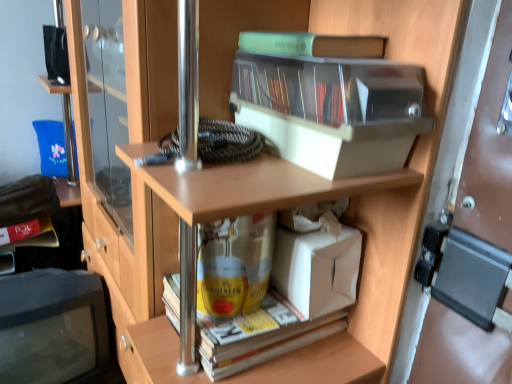
The height and width of the screenshot is (384, 512). Find the location of `transparent plastic storage box at upper center`. transparent plastic storage box at upper center is located at coordinates (331, 110).

You are a GUI agent. You are given a task and a screenshot of the screen. Output one action in this format:
    pyautogui.click(x=<x>, y=<y>)
    Task: Click on the green plastic book at upper center, acting as the 3th book starting from the bottom
    The image size is (512, 384).
    Given the screenshot: What is the action you would take?
    pyautogui.click(x=313, y=44)

What is the approximate width of green plastic book at upper center, acting as the 3th book starting from the bottom?

It is 6.25 inches.

The height and width of the screenshot is (384, 512). What do you see at coordinates (52, 327) in the screenshot?
I see `matte black monitor at lower left` at bounding box center [52, 327].

Locate an element on the screen. Image resolution: width=512 pixels, height=384 pixels. yellow paperback book at lower center, positioned as the second book in back-to-front order is located at coordinates (261, 337).

Relative to yellow paperback book at lower center, which is the first book from bottom to top, is matte yellow book at lower left, the first book viewed from the left, in front or behind?

Visually, matte yellow book at lower left, the first book viewed from the left, is located behind yellow paperback book at lower center, which is the first book from bottom to top.

How much distance is there between matte yellow book at lower left, positioned as the 3th book in right-to-left order, and yellow paperback book at lower center, which is counted as the second book, starting from the front?

They are 36.94 inches apart.

In order to click on book that is below the matte yellow book at lower left, positioned as the 3th book in right-to-left order (from the image's perspective) in this screenshot , I will do `click(261, 337)`.

Which of these two, matte yellow book at lower left, the third book from the front, or yellow paperback book at lower center, positioned as the second book in back-to-front order, is thinner?

With smaller width is matte yellow book at lower left, the third book from the front.

Does green plastic book at upper center, acting as the 3th book starting from the bottom, appear on the left side of yellow paperback book at lower center, which is the 3th book in top-to-bottom order?

No.

Is green plastic book at upper center, acting as the 3th book starting from the bottom, next to yellow paperback book at lower center, which is counted as the second book, starting from the front?

No, green plastic book at upper center, acting as the 3th book starting from the bottom, is not next to yellow paperback book at lower center, which is counted as the second book, starting from the front.

Which object is thinner, green plastic book at upper center, positioned as the 1th book in right-to-left order, or yellow paperback book at lower center, positioned as the second book in back-to-front order?

green plastic book at upper center, positioned as the 1th book in right-to-left order.

Is green plastic book at upper center, positioned as the 1th book in right-to-left order, situated inside white cardboard box at lower center or outside?

The correct answer is: outside.

How distant is green plastic book at upper center, the third book in the back-to-front sequence, from white cardboard box at lower center?

The distance of green plastic book at upper center, the third book in the back-to-front sequence, from white cardboard box at lower center is 13.84 inches.

How many degrees apart are the facing directions of green plastic book at upper center, the third book in the back-to-front sequence, and white cardboard box at lower center?

The facing directions of green plastic book at upper center, the third book in the back-to-front sequence, and white cardboard box at lower center are 0.901 degrees apart.

Who is shorter, green plastic book at upper center, the 1th book viewed from the front, or white cardboard box at lower center?

green plastic book at upper center, the 1th book viewed from the front.

Are white cardboard box at lower center and transparent plastic storage box at upper center located far from each other?

No, white cardboard box at lower center is not far from transparent plastic storage box at upper center.

Is white cardboard box at lower center thinner than transparent plastic storage box at upper center?

Correct, the width of white cardboard box at lower center is less than that of transparent plastic storage box at upper center.

Is transparent plastic storage box at upper center at the back of white cardboard box at lower center?

No.

Consider the image. Considering the sizes of yellow paperback book at lower center, which is counted as the second book, starting from the front, and matte black monitor at lower left in the image, is yellow paperback book at lower center, which is counted as the second book, starting from the front, wider or thinner than matte black monitor at lower left?

Clearly, yellow paperback book at lower center, which is counted as the second book, starting from the front, has less width compared to matte black monitor at lower left.

Considering the sizes of yellow paperback book at lower center, positioned as the second book in back-to-front order, and matte black monitor at lower left in the image, is yellow paperback book at lower center, positioned as the second book in back-to-front order, taller or shorter than matte black monitor at lower left?

yellow paperback book at lower center, positioned as the second book in back-to-front order, is shorter than matte black monitor at lower left.

From the image's perspective, is yellow paperback book at lower center, positioned as the second book in back-to-front order, located above matte black monitor at lower left?

Yes, from the image's perspective, yellow paperback book at lower center, positioned as the second book in back-to-front order, is on top of matte black monitor at lower left.

Considering the relative sizes of transparent plastic storage box at upper center and matte black monitor at lower left in the image provided, is transparent plastic storage box at upper center bigger than matte black monitor at lower left?

No, transparent plastic storage box at upper center is not bigger than matte black monitor at lower left.

How distant is transparent plastic storage box at upper center from matte black monitor at lower left?

A distance of 30.69 inches exists between transparent plastic storage box at upper center and matte black monitor at lower left.

Is point (416, 129) less distant than point (35, 274)?

Yes, point (416, 129) is closer to viewer.

Locate an element on the screen. The width and height of the screenshot is (512, 384). computer monitor lying on the left of transparent plastic storage box at upper center is located at coordinates (52, 327).

How far apart are green plastic book at upper center, the first book positioned from the top, and matte black monitor at lower left?

green plastic book at upper center, the first book positioned from the top, is 33.63 inches from matte black monitor at lower left.

Are green plastic book at upper center, acting as the 3th book starting from the bottom, and matte black monitor at lower left beside each other?

No, green plastic book at upper center, acting as the 3th book starting from the bottom, is not touching matte black monitor at lower left.

Looking at their sizes, would you say green plastic book at upper center, the 1th book viewed from the front, is wider or thinner than matte black monitor at lower left?

Clearly, green plastic book at upper center, the 1th book viewed from the front, has less width compared to matte black monitor at lower left.

This screenshot has width=512, height=384. Identify the location of book behind the yellow paperback book at lower center, which is counted as the second book, starting from the front. (36, 237).

The width and height of the screenshot is (512, 384). What are the coordinates of `book in front of the yellow paperback book at lower center, positioned as the second book in back-to-front order` in the screenshot? It's located at (313, 44).

Considering their positions, is green plastic book at upper center, the 1th book viewed from the front, positioned further to transparent plastic storage box at upper center than white cardboard box at lower center?

Among the two, white cardboard box at lower center is located further to transparent plastic storage box at upper center.

Looking at the image, which one is located closer to matte yellow book at lower left, positioned as the 1th book in back-to-front order, green plastic book at upper center, the 1th book viewed from the front, or white cardboard box at lower center?

Among the two, white cardboard box at lower center is located nearer to matte yellow book at lower left, positioned as the 1th book in back-to-front order.

Estimate the real-world distances between objects in this image. Which object is closer to yellow paperback book at lower center, which is the 3th book in top-to-bottom order, matte yellow book at lower left, positioned as the 1th book in back-to-front order, or white cardboard box at lower center?

The object closer to yellow paperback book at lower center, which is the 3th book in top-to-bottom order, is white cardboard box at lower center.

Estimate the real-world distances between objects in this image. Which object is closer to yellow paperback book at lower center, the 2th book positioned from the left, green plastic book at upper center, arranged as the third book when viewed from the left, or matte black monitor at lower left?

green plastic book at upper center, arranged as the third book when viewed from the left, is closer to yellow paperback book at lower center, the 2th book positioned from the left.

Considering their positions, is yellow paperback book at lower center, which is counted as the second book, starting from the front, positioned closer to transparent plastic storage box at upper center than white cardboard box at lower center?

white cardboard box at lower center is positioned closer to the anchor transparent plastic storage box at upper center.

Considering their positions, is matte black monitor at lower left positioned further to transparent plastic storage box at upper center than white cardboard box at lower center?

Among the two, matte black monitor at lower left is located further to transparent plastic storage box at upper center.

Estimate the real-world distances between objects in this image. Which object is closer to transparent plastic storage box at upper center, green plastic book at upper center, the third book in the back-to-front sequence, or yellow paperback book at lower center, placed as the second book when sorted from right to left?

The object closer to transparent plastic storage box at upper center is green plastic book at upper center, the third book in the back-to-front sequence.

Considering their positions, is matte yellow book at lower left, the 2th book in the bottom-to-top sequence, positioned further to matte black monitor at lower left than green plastic book at upper center, arranged as the third book when viewed from the left?

green plastic book at upper center, arranged as the third book when viewed from the left, is positioned further to the anchor matte black monitor at lower left.

Locate an element on the screen. box between transparent plastic storage box at upper center and yellow paperback book at lower center, which is the first book from bottom to top, vertically is located at coordinates (316, 269).

I want to click on computer monitor situated between matte yellow book at lower left, the first book viewed from the left, and yellow paperback book at lower center, which is counted as the second book, starting from the front, from left to right, so click(52, 327).

The image size is (512, 384). Identify the location of box located between matte black monitor at lower left and transparent plastic storage box at upper center in the left-right direction. (316, 269).

Where is `cabinet between green plastic book at upper center, arranged as the third book when viewed from the left, and white cardboard box at lower center, in the vertical direction`? Image resolution: width=512 pixels, height=384 pixels. cabinet between green plastic book at upper center, arranged as the third book when viewed from the left, and white cardboard box at lower center, in the vertical direction is located at coordinates (331, 110).